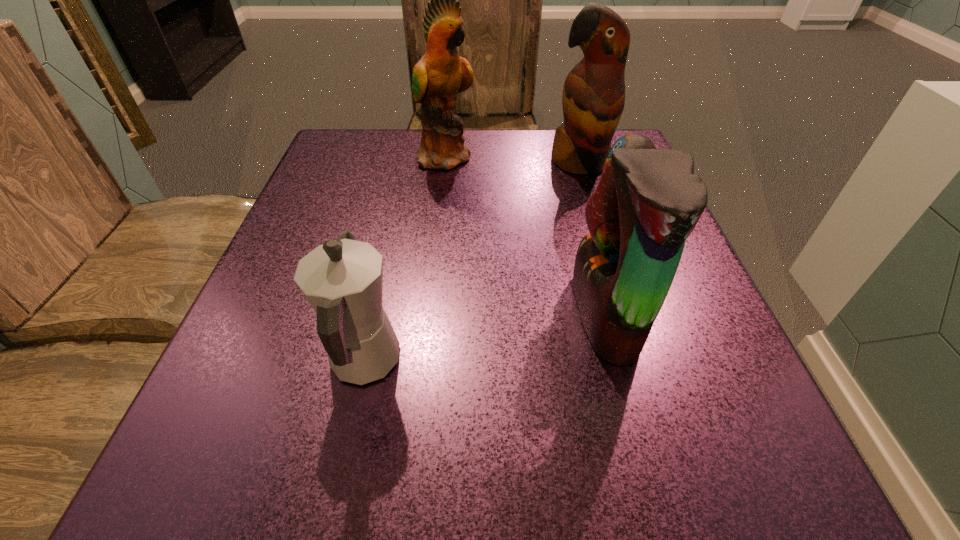
Locate an element on the screen. object that is positioned at the far right corner is located at coordinates (593, 98).

Identify the location of vacant space at the near edge of the desktop. This screenshot has height=540, width=960. (426, 448).

Identify the location of free space at the left edge of the desktop. (295, 304).

The width and height of the screenshot is (960, 540). In order to click on free space at the right edge of the desktop in this screenshot , I will do `click(735, 365)`.

The image size is (960, 540). I want to click on vacant area at the near left corner of the desktop, so click(272, 456).

Find the location of a particular element. empty location between the second shortest object and the shortest object is located at coordinates (485, 338).

What are the coordinates of `free space between the third tallest object and the leftmost parrot` in the screenshot? It's located at click(526, 235).

This screenshot has width=960, height=540. Find the location of `vacant area between the coffeepot and the leftmost parrot`. vacant area between the coffeepot and the leftmost parrot is located at coordinates (405, 259).

Find the location of a particular element. empty location between the shortest parrot and the leftmost parrot is located at coordinates (526, 235).

I want to click on free space between the leftmost parrot and the shortest object, so click(x=405, y=259).